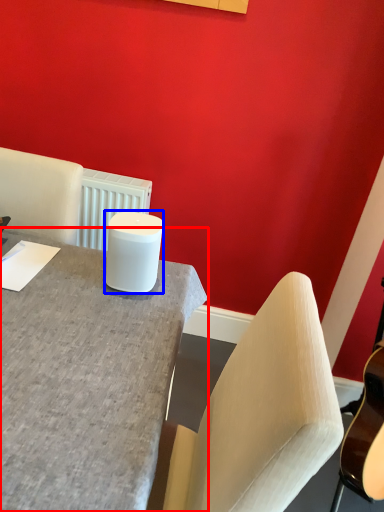
Question: Among these objects, which one is nearest to the camera, desk (highlighted by a red box) or candle holder (highlighted by a blue box)?

Choices:
 (A) desk
 (B) candle holder

Answer: (A)